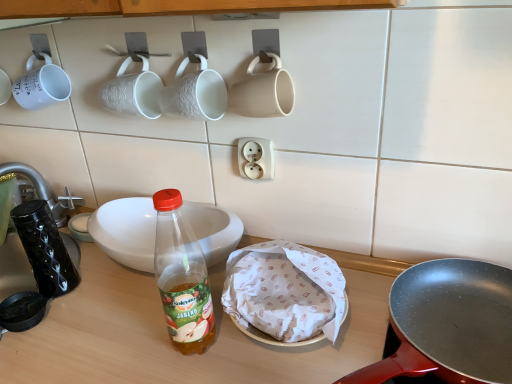
I want to click on vacant space to the left of white paper wrapped food at center, so click(x=170, y=339).